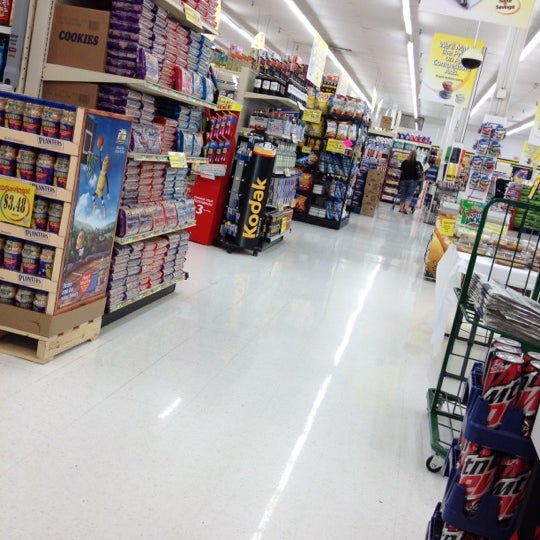
In order to click on wall display in this screenshot , I will do `click(486, 148)`.